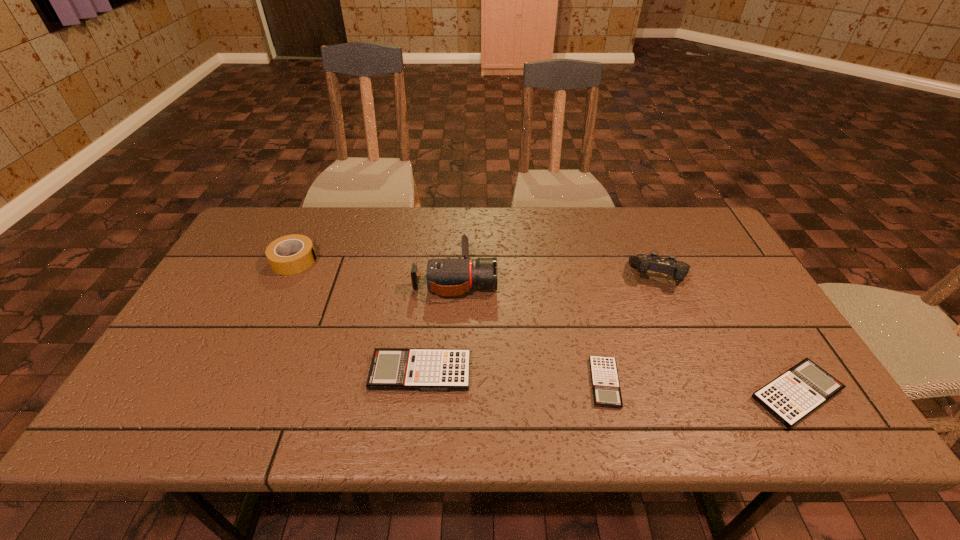
Locate an element on the screen. This screenshot has height=540, width=960. vacant space situated 0.320m on the right of the leftmost calculator is located at coordinates (607, 372).

The image size is (960, 540). I want to click on vacant space situated on the left of the shortest object, so pos(431,383).

This screenshot has width=960, height=540. What are the coordinates of `vacant space located on the back of the second shortest object` in the screenshot? It's located at (718, 262).

Where is `vacant space located 0.090m at the edge of the fourth shortest object`? The width and height of the screenshot is (960, 540). vacant space located 0.090m at the edge of the fourth shortest object is located at coordinates (348, 261).

This screenshot has width=960, height=540. What are the coordinates of `free location located 0.370m on the lens of the camcorder` in the screenshot? It's located at (625, 278).

The width and height of the screenshot is (960, 540). Find the location of `vacant space located on the back of the second object from right to left`. vacant space located on the back of the second object from right to left is located at coordinates (639, 229).

The image size is (960, 540). What are the coordinates of `object that is positioned at the far edge` in the screenshot? It's located at pos(276,252).

Identify the location of object at the left edge. (276, 252).

Locate an element on the screen. Image resolution: width=960 pixels, height=540 pixels. calculator located at the right edge is located at coordinates pyautogui.click(x=792, y=396).

Image resolution: width=960 pixels, height=540 pixels. What are the coordinates of `control located in the right edge section of the desktop` in the screenshot? It's located at (652, 262).